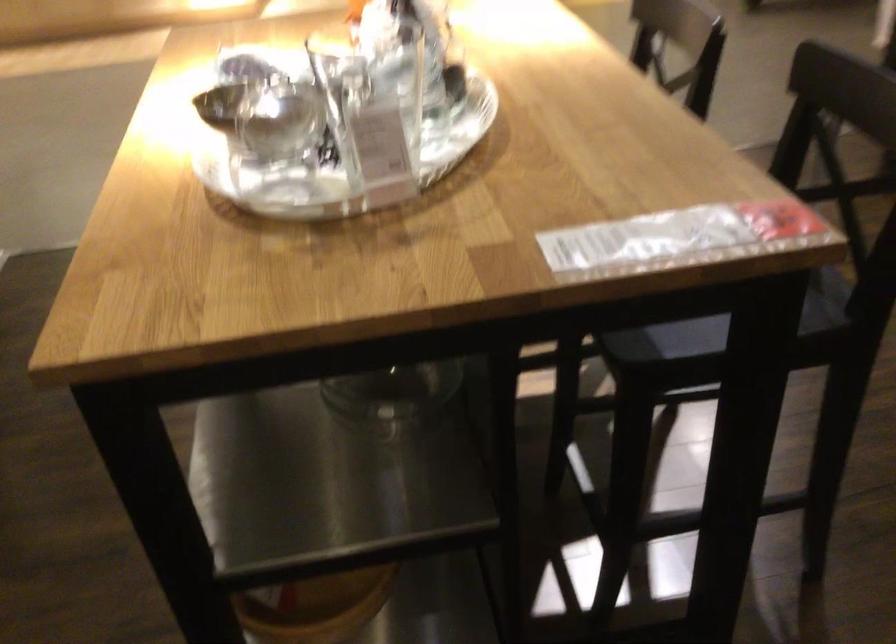
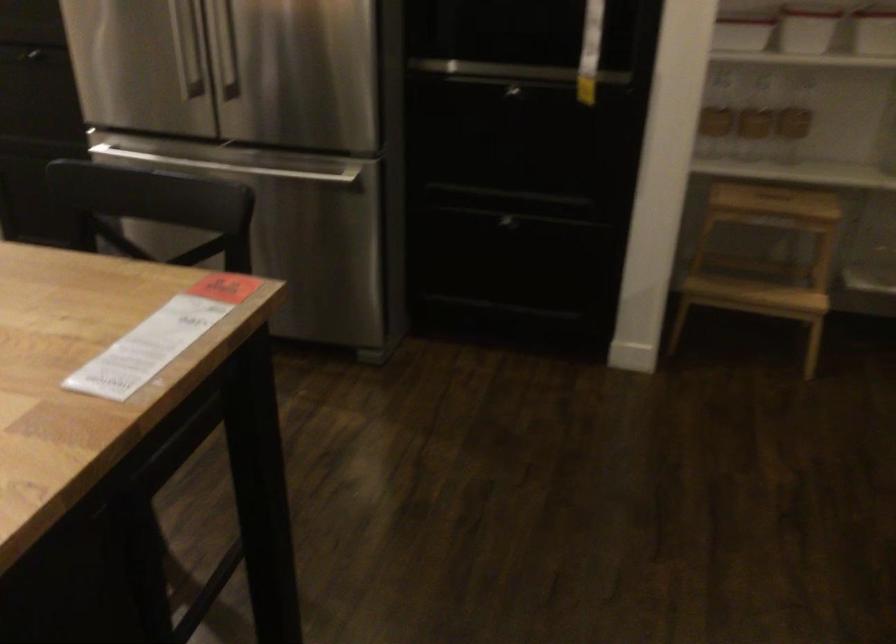
Question: Based on the continuous images, in which direction is the camera rotating? Reply with the corresponding letter.

Choices:
 (A) Left
 (B) Right
 (C) Up
 (D) Down

Answer: (B)